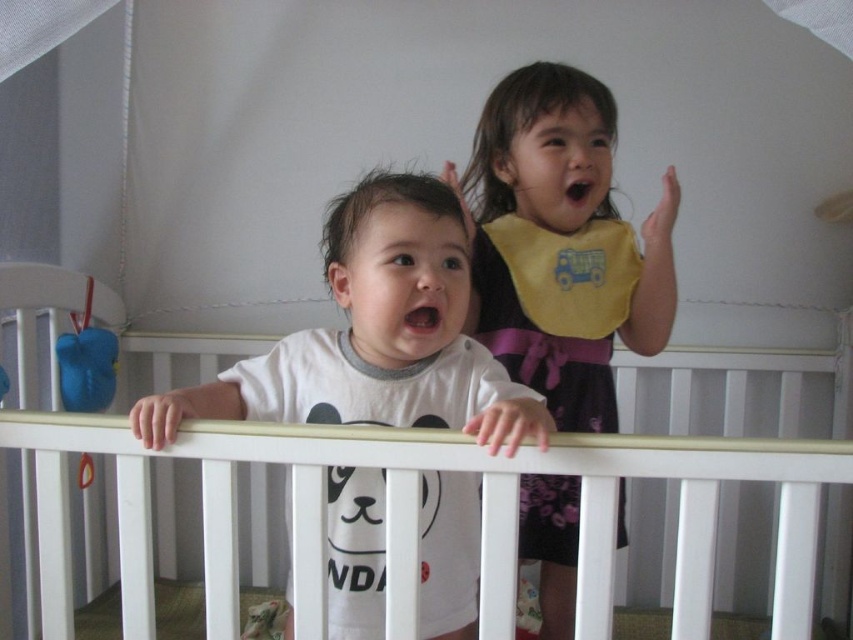
Is white matte shirt at center in front of yellow fabric bib at upper center?

Yes.

Image resolution: width=853 pixels, height=640 pixels. What do you see at coordinates (375, 336) in the screenshot?
I see `white matte shirt at center` at bounding box center [375, 336].

Who is more forward, (508, 426) or (517, 368)?

Point (508, 426)

The width and height of the screenshot is (853, 640). In order to click on white matte shirt at center in this screenshot , I will do `click(375, 336)`.

Who is more distant from viewer, (381, 483) or (93, 468)?

The point (93, 468) is behind.

I want to click on white matte shirt at center, so click(x=375, y=336).

Does point (549, 426) come closer to viewer compared to point (103, 376)?

Yes.

Find the location of a particular element. This screenshot has width=853, height=640. white matte shirt at center is located at coordinates (375, 336).

Who is taller, white wooden crib at center or yellow fabric bib at upper center?

yellow fabric bib at upper center

At what (x,y) coordinates should I click in order to perform the action: click on white wooden crib at center. Please return your answer as a coordinate pair (x, y). Image resolution: width=853 pixels, height=640 pixels. Looking at the image, I should click on (515, 512).